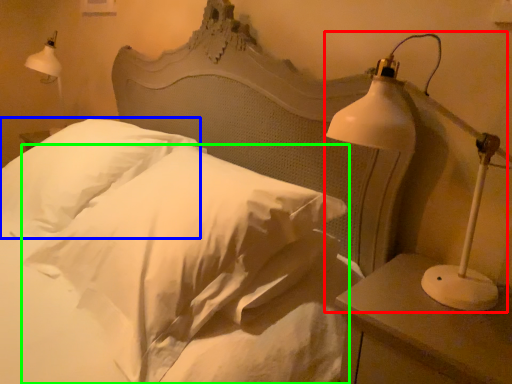
Question: Estimate the real-world distances between objects in this image. Which object is farther from lamp (highlighted by a red box), pillow (highlighted by a blue box) or pillow (highlighted by a green box)?

Choices:
 (A) pillow
 (B) pillow

Answer: (A)